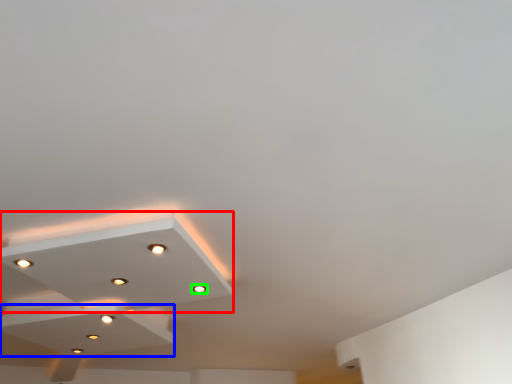
Question: Which is farther away from lamp (highlighted by a red box)? exhaust hood (highlighted by a blue box) or light (highlighted by a green box)?

Choices:
 (A) exhaust hood
 (B) light

Answer: (B)